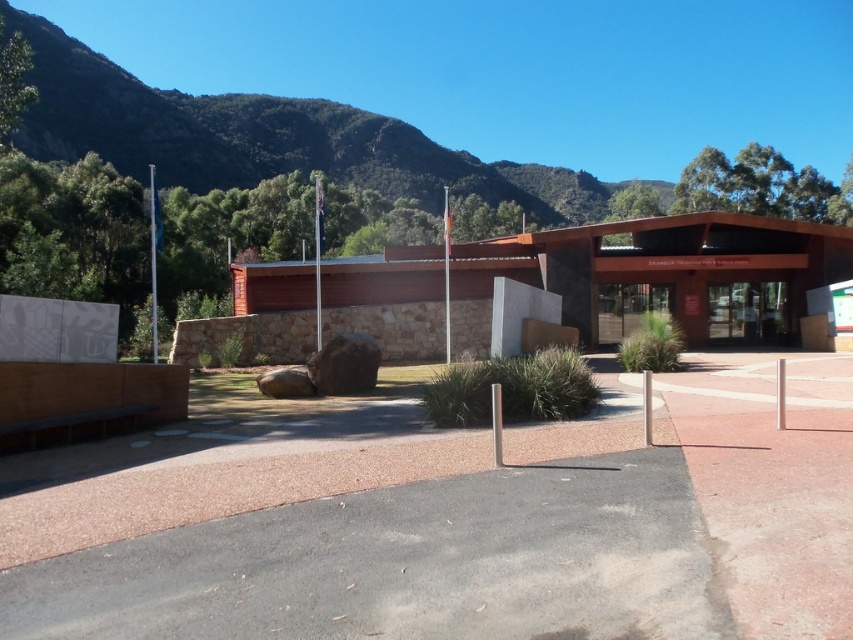
Question: Can you confirm if green textured rock at upper center is smaller than transparent glass doors at center?

Choices:
 (A) yes
 (B) no

Answer: (B)

Question: Among these points, which one is nearest to the camera?

Choices:
 (A) (616, 340)
 (B) (766, 339)

Answer: (B)

Question: Does green textured rock at upper center appear on the left side of transparent glass doors at center?

Choices:
 (A) yes
 (B) no

Answer: (A)

Question: Which of the following is the farthest from the observer?

Choices:
 (A) transparent glass doors at center
 (B) transparent glass door at center

Answer: (B)

Question: From the image, what is the correct spatial relationship of green textured rock at upper center in relation to transparent glass doors at center?

Choices:
 (A) right
 (B) left

Answer: (B)

Question: Which point appears closest to the camera in this image?

Choices:
 (A) coord(117,164)
 (B) coord(722,291)

Answer: (B)